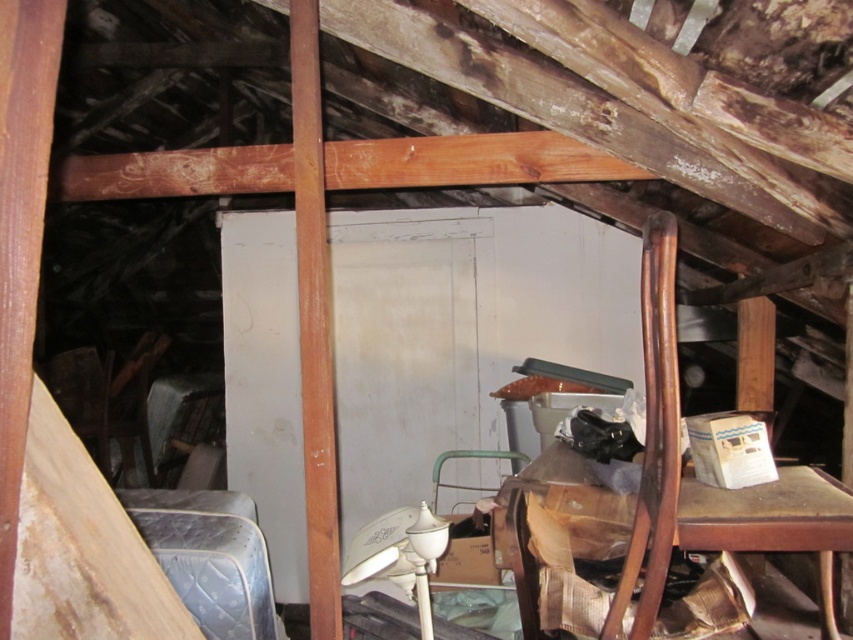
You are standing in the attic and see the point marked at coordinates (680, 468). What object is located at that point?

The point at coordinates (680, 468) corresponds to the wooden chair at center.

Consider the image. You are organizing items in the attic and need to move the wooden chair at center and the blue quilted mattress at lower left. Based on their positions, which item is closer to the ceiling?

The wooden chair at center is above the blue quilted mattress at lower left, so it is closer to the ceiling.